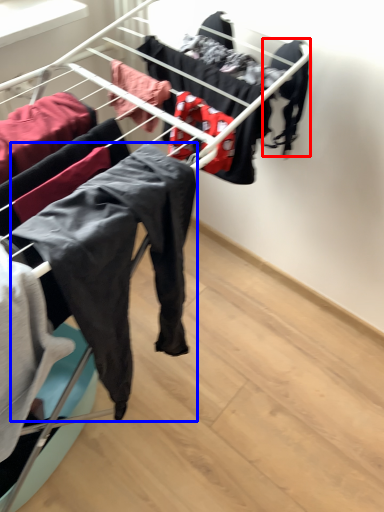
Question: Among these objects, which one is nearest to the camera, clothing (highlighted by a red box) or clothing (highlighted by a blue box)?

Choices:
 (A) clothing
 (B) clothing

Answer: (B)